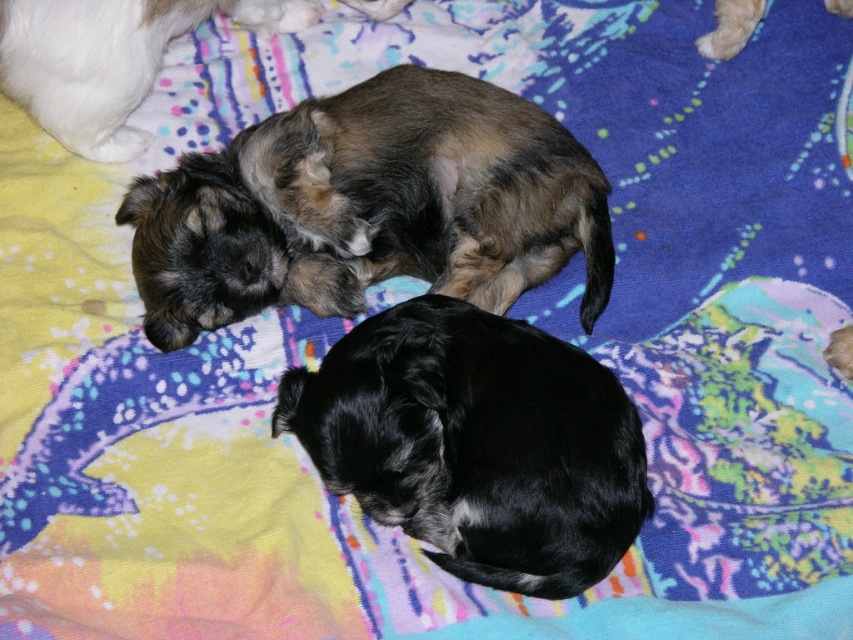
Looking at this image, you are standing in front of the blanket and see the black fur dog at center. Can you determine its exact position on the blanket using coordinates?

The black fur dog at center is located at point coordinates of [477,444].

Based on the scene description, where is the brown fuzzy dog at center located in terms of coordinates?

The brown fuzzy dog at center is located at coordinates point (370,205).

You are a dog owner who wants to place a small toy between the brown fuzzy dog at center and the black fur dog at center. Since the dogs are close, you need to know which one is taller to avoid stepping on them. Can you tell me which dog is taller?

The brown fuzzy dog at center is taller than the black fur dog at center.